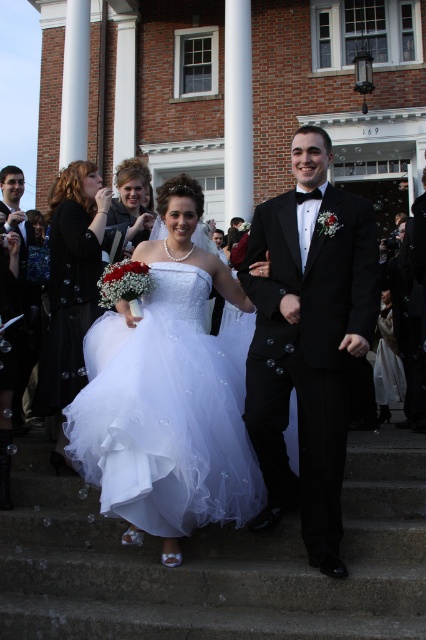
Question: Is smooth concrete stairs at center above white tulle dress at center?

Choices:
 (A) yes
 (B) no

Answer: (B)

Question: Which point is farther to the camera?

Choices:
 (A) white tulle dress at center
 (B) matte white dress at center
 (C) matte black dress at left

Answer: (B)

Question: Which point is closer to the camera taking this photo?

Choices:
 (A) (317, 176)
 (B) (420, 552)
 (C) (20, 392)
 (D) (83, 374)

Answer: (B)

Question: Does white tulle dress at center lie in front of black satin tuxedo at center?

Choices:
 (A) no
 (B) yes

Answer: (A)

Question: Estimate the real-world distances between objects in this image. Which object is closer to the shiny black tuxedo at left?

Choices:
 (A) white tulle dress at center
 (B) smooth concrete stairs at center
 (C) matte white dress at center
 (D) black satin tuxedo at center

Answer: (C)

Question: Is white tulle dress at center bigger than matte black dress at left?

Choices:
 (A) no
 (B) yes

Answer: (B)